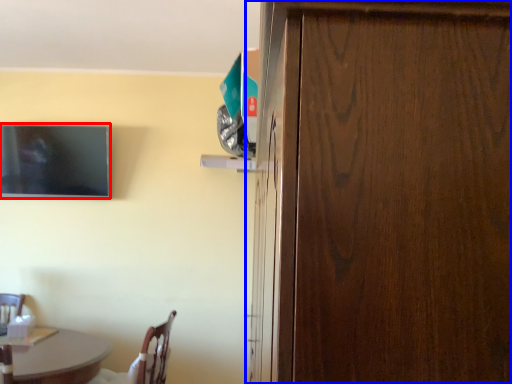
Question: Which point is closer to the camera, television (highlighted by a red box) or door (highlighted by a blue box)?

Choices:
 (A) television
 (B) door

Answer: (B)